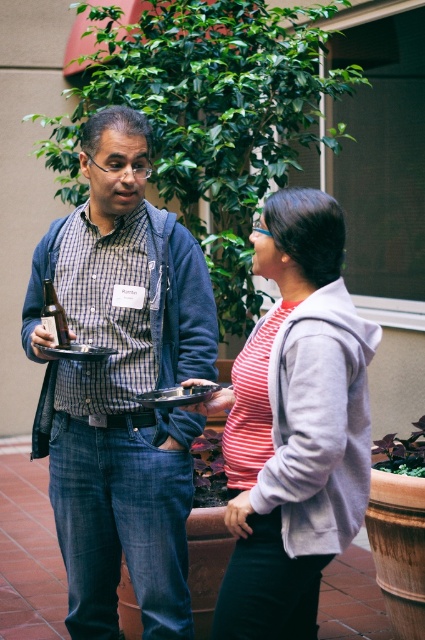
Is matte blue jeans at center shorter than striped cotton shirt at center?

No, matte blue jeans at center is not shorter than striped cotton shirt at center.

Who is taller, matte blue jeans at center or striped cotton shirt at center?

Standing taller between the two is matte blue jeans at center.

Is point (164, 332) positioned in front of point (312, 554)?

That is False.

Locate an element on the screen. This screenshot has height=640, width=425. matte blue jeans at center is located at coordinates (121, 385).